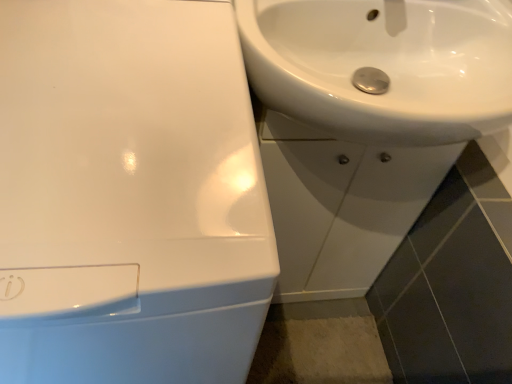
Question: Should I look upward or downward to see white glossy sink at upper right, which appears as the third sink when viewed from the left?

Choices:
 (A) up
 (B) down

Answer: (A)

Question: Is white glossy sink at center, which appears as the 2th sink when viewed from the right, not close to white glossy sink at upper right, marked as the 1th sink in a left-to-right arrangement?

Choices:
 (A) yes
 (B) no

Answer: (B)

Question: From the image's perspective, is white glossy sink at center, which appears as the 2th sink when viewed from the right, beneath white glossy sink at upper right, acting as the third sink starting from the right?

Choices:
 (A) yes
 (B) no

Answer: (B)

Question: Does white glossy sink at center, which ranks as the second sink in left-to-right order, lie behind white glossy sink at upper right, marked as the 1th sink in a left-to-right arrangement?

Choices:
 (A) yes
 (B) no

Answer: (A)

Question: Can you confirm if white glossy sink at center, which appears as the 2th sink when viewed from the right, is thinner than white glossy sink at upper right, marked as the 1th sink in a left-to-right arrangement?

Choices:
 (A) no
 (B) yes

Answer: (B)

Question: Is white glossy sink at center, which ranks as the second sink in left-to-right order, oriented away from white glossy sink at upper right, marked as the 1th sink in a left-to-right arrangement?

Choices:
 (A) no
 (B) yes

Answer: (A)

Question: Would you say white glossy sink at center, which ranks as the second sink in left-to-right order, is outside white glossy sink at upper right, marked as the 1th sink in a left-to-right arrangement?

Choices:
 (A) no
 (B) yes

Answer: (B)

Question: Is white glossy sink at upper right, which appears as the first sink when viewed from the right, to the right of white glossy sink at center, which ranks as the second sink in left-to-right order, from the viewer's perspective?

Choices:
 (A) no
 (B) yes

Answer: (B)

Question: From the image's perspective, would you say white glossy sink at upper right, which appears as the first sink when viewed from the right, is positioned over white glossy sink at center, which ranks as the second sink in left-to-right order?

Choices:
 (A) no
 (B) yes

Answer: (B)

Question: Does white glossy sink at upper right, which appears as the first sink when viewed from the right, come in front of white glossy sink at center, which appears as the 2th sink when viewed from the right?

Choices:
 (A) no
 (B) yes

Answer: (B)

Question: From the image's perspective, is white glossy sink at upper right, which appears as the third sink when viewed from the left, located beneath white glossy sink at center, which appears as the 2th sink when viewed from the right?

Choices:
 (A) no
 (B) yes

Answer: (A)

Question: Considering the relative positions of white glossy sink at upper right, which appears as the third sink when viewed from the left, and white glossy sink at center, which appears as the 2th sink when viewed from the right, in the image provided, is white glossy sink at upper right, which appears as the third sink when viewed from the left, to the left of white glossy sink at center, which appears as the 2th sink when viewed from the right, from the viewer's perspective?

Choices:
 (A) no
 (B) yes

Answer: (A)

Question: Does white glossy sink at upper right, which appears as the first sink when viewed from the right, have a greater height compared to white glossy sink at center, which appears as the 2th sink when viewed from the right?

Choices:
 (A) no
 (B) yes

Answer: (A)

Question: Can you confirm if white glossy sink at upper right, marked as the 1th sink in a left-to-right arrangement, is wider than white glossy sink at center, which ranks as the second sink in left-to-right order?

Choices:
 (A) no
 (B) yes

Answer: (B)